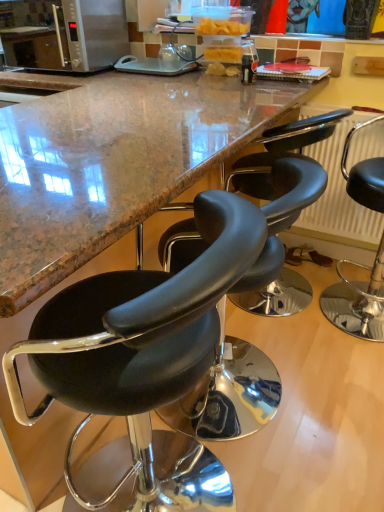
What do you see at coordinates (142, 364) in the screenshot?
I see `black leather stool at center, which is the first chair from left to right` at bounding box center [142, 364].

How much space does black leather stool at right, which is counted as the first chair, starting from the right, occupy vertically?

The height of black leather stool at right, which is counted as the first chair, starting from the right, is 36.38 inches.

Describe the element at coordinates (358, 298) in the screenshot. I see `black leather stool at right, which is counted as the 3th chair, starting from the left` at that location.

The height and width of the screenshot is (512, 384). Identify the location of black leather stool at center, marked as the 3th chair in a right-to-left arrangement. (142, 364).

From the image's perspective, is black leather stool at center, marked as the 3th chair in a right-to-left arrangement, under satin silver microwave at upper left?

Yes.

Are black leather stool at center, which is the first chair from left to right, and satin silver microwave at upper left located far from each other?

That's right, there is a large distance between black leather stool at center, which is the first chair from left to right, and satin silver microwave at upper left.

Which is behind, point (87, 323) or point (36, 19)?

The point (36, 19) is farther from the camera.

Between black leather stool at center, which is the first chair from left to right, and satin silver microwave at upper left, which one has larger width?

With larger width is black leather stool at center, which is the first chair from left to right.

From the picture: Is black leather stool at center, the second chair from the left, inside or outside of satin silver microwave at upper left?

black leather stool at center, the second chair from the left, is outside satin silver microwave at upper left.

How many degrees apart are the facing directions of black leather stool at center, marked as the 2th chair in a right-to-left arrangement, and satin silver microwave at upper left?

They differ by 90 degrees in their facing directions.

Which is more to the right, black leather stool at center, marked as the 2th chair in a right-to-left arrangement, or satin silver microwave at upper left?

From the viewer's perspective, black leather stool at center, marked as the 2th chair in a right-to-left arrangement, appears more on the right side.

Is black leather stool at center, the second chair from the left, with satin silver microwave at upper left?

black leather stool at center, the second chair from the left, and satin silver microwave at upper left are not in contact.

From the picture: Considering the sizes of black leather stool at center, marked as the 2th chair in a right-to-left arrangement, and metallic radiator at right in the image, is black leather stool at center, marked as the 2th chair in a right-to-left arrangement, wider or thinner than metallic radiator at right?

black leather stool at center, marked as the 2th chair in a right-to-left arrangement, is wider than metallic radiator at right.

Between black leather stool at center, marked as the 2th chair in a right-to-left arrangement, and metallic radiator at right, which one has larger size?

black leather stool at center, marked as the 2th chair in a right-to-left arrangement, is bigger.

Which object is more forward, black leather stool at center, marked as the 2th chair in a right-to-left arrangement, or metallic radiator at right?

black leather stool at center, marked as the 2th chair in a right-to-left arrangement.

Can you tell me how much black leather stool at center, marked as the 2th chair in a right-to-left arrangement, and black leather stool at center, which is the first chair from left to right, differ in facing direction?

The angular difference between black leather stool at center, marked as the 2th chair in a right-to-left arrangement, and black leather stool at center, which is the first chair from left to right, is 0.000971 degrees.

Based on the photo, considering the sizes of objects black leather stool at center, the second chair from the left, and black leather stool at center, which is the first chair from left to right, in the image provided, who is bigger, black leather stool at center, the second chair from the left, or black leather stool at center, which is the first chair from left to right,?

With larger size is black leather stool at center, which is the first chair from left to right.

Is black leather stool at center, the second chair from the left, surrounding black leather stool at center, which is the first chair from left to right?

Definitely not — black leather stool at center, which is the first chair from left to right, is not inside black leather stool at center, the second chair from the left.

Does black leather stool at center, marked as the 2th chair in a right-to-left arrangement, have a greater height compared to black leather stool at center, marked as the 3th chair in a right-to-left arrangement?

No.

Can you confirm if satin silver microwave at upper left is taller than black leather stool at center, the second chair from the left?

No, satin silver microwave at upper left is not taller than black leather stool at center, the second chair from the left.

Can you confirm if satin silver microwave at upper left is positioned to the left of black leather stool at center, the second chair from the left?

Correct, you'll find satin silver microwave at upper left to the left of black leather stool at center, the second chair from the left.

Which point is more distant from viewer, (40, 9) or (297, 211)?

The point (40, 9) is farther.

Is black leather stool at center, the second chair from the left, to the left or to the right of black leather stool at right, which is counted as the 3th chair, starting from the left, in the image?

In the image, black leather stool at center, the second chair from the left, appears on the left side of black leather stool at right, which is counted as the 3th chair, starting from the left.

From a real-world perspective, which chair is the 1st one above the black leather stool at center, marked as the 2th chair in a right-to-left arrangement? Please provide its 2D coordinates.

[(358, 298)]

Which of these two, black leather stool at center, marked as the 2th chair in a right-to-left arrangement, or black leather stool at right, which is counted as the first chair, starting from the right, is wider?

black leather stool at center, marked as the 2th chair in a right-to-left arrangement.

Is satin silver microwave at upper left positioned before black leather stool at right, which is counted as the first chair, starting from the right?

That is False.

Considering the sizes of objects satin silver microwave at upper left and black leather stool at right, which is counted as the 3th chair, starting from the left, in the image provided, who is smaller, satin silver microwave at upper left or black leather stool at right, which is counted as the 3th chair, starting from the left,?

satin silver microwave at upper left.

From the image's perspective, which is below, satin silver microwave at upper left or black leather stool at right, which is counted as the 3th chair, starting from the left?

black leather stool at right, which is counted as the 3th chair, starting from the left, appears lower in the image.

Consider the image. Are satin silver microwave at upper left and black leather stool at right, which is counted as the first chair, starting from the right, located far from each other?

satin silver microwave at upper left is positioned a significant distance from black leather stool at right, which is counted as the first chair, starting from the right.

This screenshot has height=512, width=384. In order to click on the 1st chair to the right of the satin silver microwave at upper left, counting from the anchor's position in this screenshot , I will do `click(142, 364)`.

Locate an element on the screen. Image resolution: width=384 pixels, height=512 pixels. microwave oven on the left of the black leather stool at center, the second chair from the left is located at coordinates (64, 33).

Looking at the image, which one is located further to satin silver microwave at upper left, black leather stool at right, which is counted as the 3th chair, starting from the left, or metallic radiator at right?

black leather stool at right, which is counted as the 3th chair, starting from the left.

From the image, which object appears to be farther from metallic radiator at right, black leather stool at center, marked as the 3th chair in a right-to-left arrangement, or black leather stool at center, marked as the 2th chair in a right-to-left arrangement?

black leather stool at center, marked as the 3th chair in a right-to-left arrangement, is positioned further to the anchor metallic radiator at right.

From the picture: Which object lies nearer to the anchor point metallic radiator at right, black leather stool at right, which is counted as the 3th chair, starting from the left, or black leather stool at center, the second chair from the left?

Among the two, black leather stool at right, which is counted as the 3th chair, starting from the left, is located nearer to metallic radiator at right.

When comparing their distances from black leather stool at center, marked as the 3th chair in a right-to-left arrangement, does metallic radiator at right or satin silver microwave at upper left seem closer?

metallic radiator at right is closer to black leather stool at center, marked as the 3th chair in a right-to-left arrangement.

When comparing their distances from black leather stool at center, marked as the 2th chair in a right-to-left arrangement, does black leather stool at right, which is counted as the 3th chair, starting from the left, or satin silver microwave at upper left seem further?

Among the two, satin silver microwave at upper left is located further to black leather stool at center, marked as the 2th chair in a right-to-left arrangement.

Which object lies nearer to the anchor point black leather stool at right, which is counted as the first chair, starting from the right, satin silver microwave at upper left or black leather stool at center, marked as the 3th chair in a right-to-left arrangement?

Among the two, black leather stool at center, marked as the 3th chair in a right-to-left arrangement, is located nearer to black leather stool at right, which is counted as the first chair, starting from the right.

From the image, which object appears to be farther from black leather stool at center, marked as the 2th chair in a right-to-left arrangement, black leather stool at center, which is the first chair from left to right, or satin silver microwave at upper left?

satin silver microwave at upper left.

Considering their positions, is black leather stool at center, the second chair from the left, positioned closer to metallic radiator at right than black leather stool at right, which is counted as the 3th chair, starting from the left?

Based on the image, black leather stool at right, which is counted as the 3th chair, starting from the left, appears to be nearer to metallic radiator at right.

Locate an element on the screen. Image resolution: width=384 pixels, height=512 pixels. chair positioned between black leather stool at center, marked as the 2th chair in a right-to-left arrangement, and metallic radiator at right from near to far is located at coordinates (358, 298).

The height and width of the screenshot is (512, 384). In order to click on radiator between black leather stool at center, marked as the 3th chair in a right-to-left arrangement, and satin silver microwave at upper left, along the z-axis in this screenshot , I will do `click(339, 197)`.

What are the coordinates of `radiator between satin silver microwave at upper left and black leather stool at right, which is counted as the 3th chair, starting from the left, in the horizontal direction` in the screenshot? It's located at (339, 197).

Where is `chair between black leather stool at center, marked as the 3th chair in a right-to-left arrangement, and black leather stool at right, which is counted as the first chair, starting from the right, in the horizontal direction`? Image resolution: width=384 pixels, height=512 pixels. chair between black leather stool at center, marked as the 3th chair in a right-to-left arrangement, and black leather stool at right, which is counted as the first chair, starting from the right, in the horizontal direction is located at coordinates (228, 396).